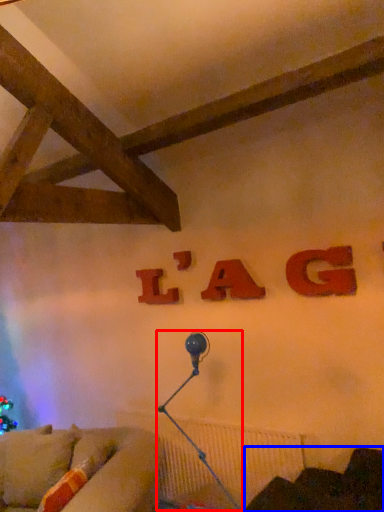
Question: Which object is further to the camera taking this photo, lamp (highlighted by a red box) or furniture (highlighted by a blue box)?

Choices:
 (A) lamp
 (B) furniture

Answer: (A)